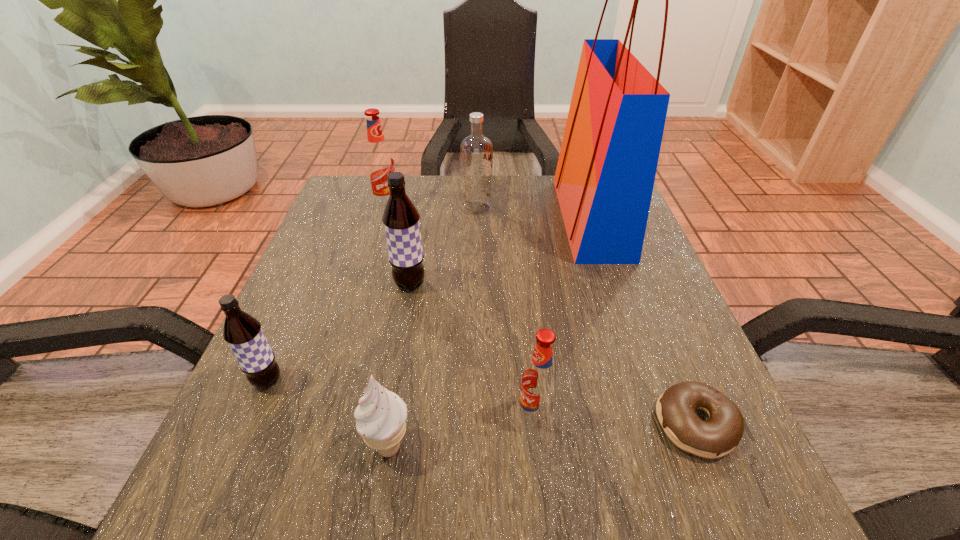
The width and height of the screenshot is (960, 540). Find the location of `the leftmost object`. the leftmost object is located at coordinates pyautogui.click(x=243, y=333).

Image resolution: width=960 pixels, height=540 pixels. I want to click on icecream, so click(381, 415).

This screenshot has width=960, height=540. I want to click on brown doughnut, so click(x=675, y=408).

This screenshot has height=540, width=960. I want to click on doughnut, so click(675, 408).

Locate an element on the screen. The image size is (960, 540). vacant space situated 0.250m on the handle side of the shopping bag is located at coordinates (456, 218).

You are a GUI agent. You are given a task and a screenshot of the screen. Output one action in this format:
    pyautogui.click(x=<x>, y=<y>)
    Task: Click on the free space located on the handle side of the shopping bag
    
    Given the screenshot: What is the action you would take?
    pyautogui.click(x=498, y=218)

Locate an element on the screen. Image resolution: width=960 pixels, height=540 pixels. vacant area situated on the handle side of the shopping bag is located at coordinates pyautogui.click(x=502, y=218).

This screenshot has height=540, width=960. Identify the location of vacant space situated 0.110m on the front of the third root beer from right to left. (376, 240).

At what (x,y) coordinates should I click in order to perform the action: click on vacant space located on the back of the right brown root beer. Please return your answer as a coordinate pair (x, y). This screenshot has height=540, width=960. Looking at the image, I should click on (421, 221).

Where is `free spot located 0.310m on the front label of the vodka`? free spot located 0.310m on the front label of the vodka is located at coordinates (617, 209).